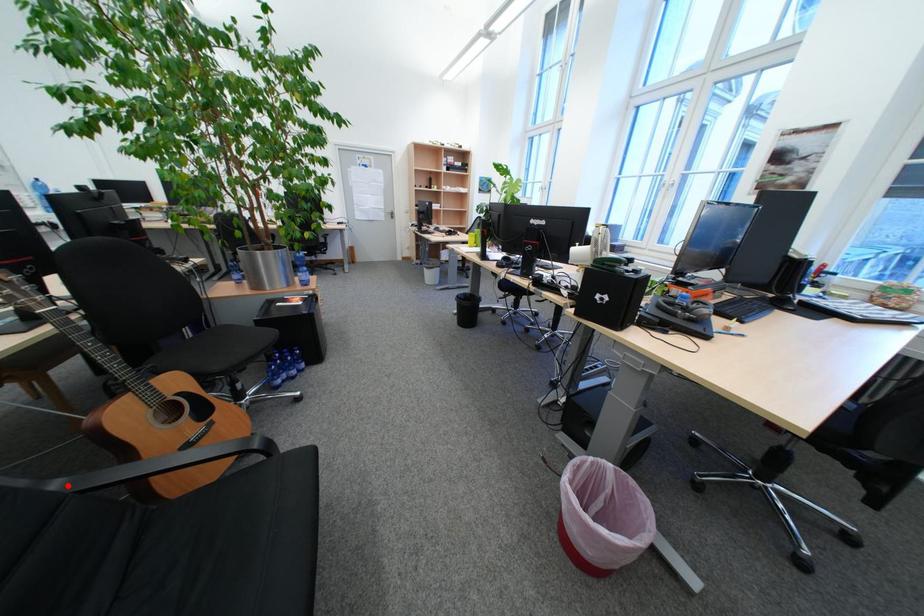
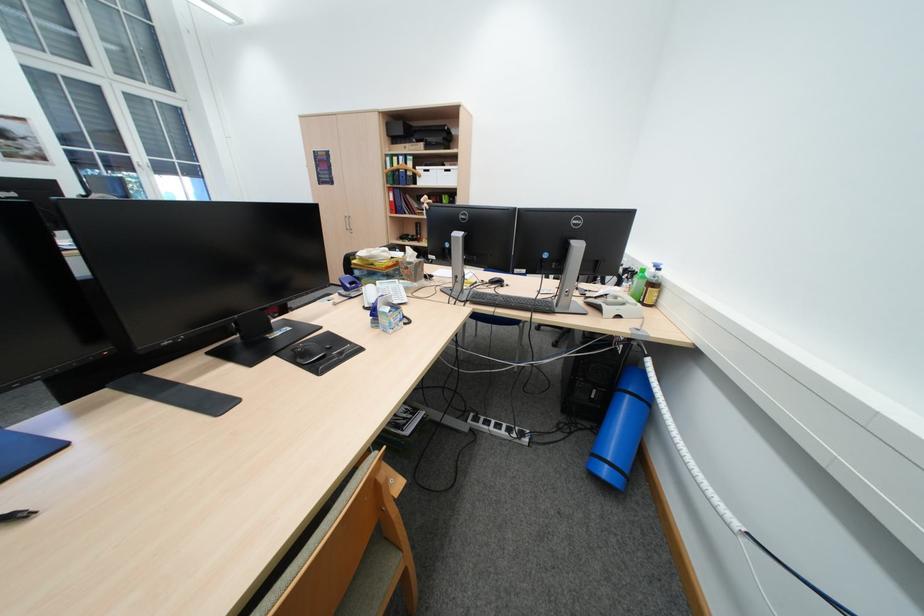
Question: I am providing you with two images of the same scene from different viewpoints. A red point is marked on the first image. Can you still see the location of the red point in image 2?

Choices:
 (A) Yes
 (B) No

Answer: (B)